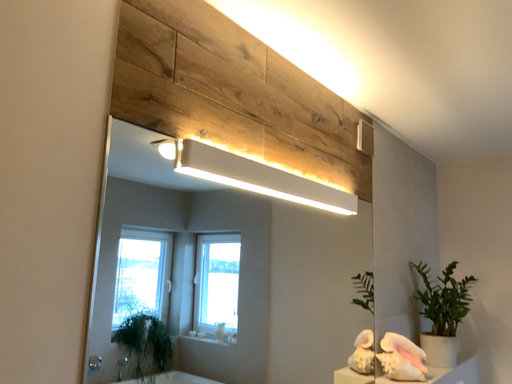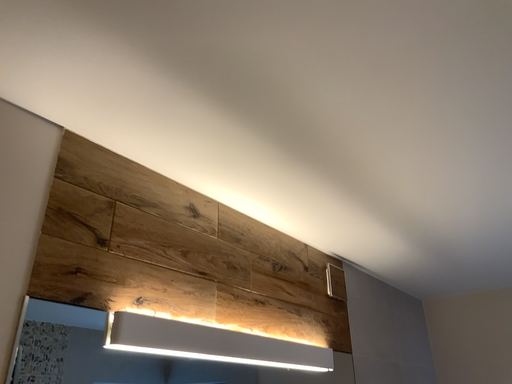
Question: How did the camera likely rotate when shooting the video?

Choices:
 (A) rotated upward
 (B) rotated downward

Answer: (A)